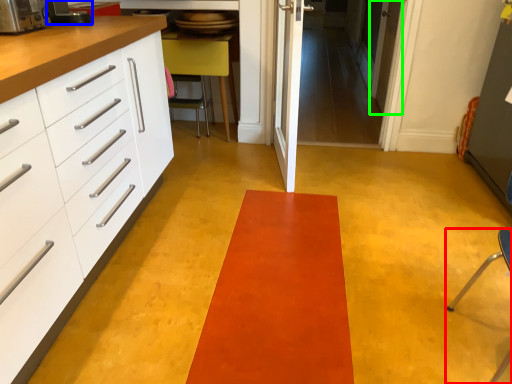
Question: Which object is the farthest from furniture (highlighted by a red box)? Choose among these: appliance (highlighted by a blue box) or door (highlighted by a green box).

Choices:
 (A) appliance
 (B) door

Answer: (A)